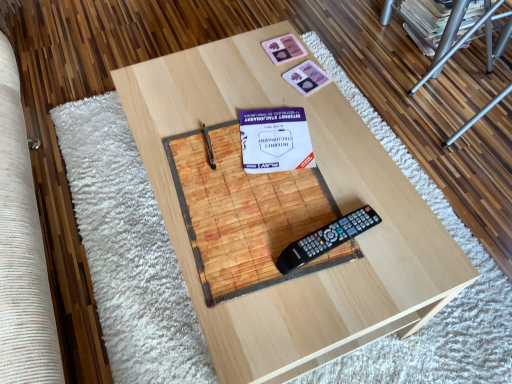
Question: Which direction should I rotate to look at pink matte playing card at upper center, which ranks as the 2th square in top-to-bottom order, — up or down?

Choices:
 (A) up
 (B) down

Answer: (A)

Question: Could you tell me if metallic silver ladder at upper right is turned towards white paper at center?

Choices:
 (A) yes
 (B) no

Answer: (B)

Question: Is metallic silver ladder at upper right positioned before white paper at center?

Choices:
 (A) yes
 (B) no

Answer: (B)

Question: Is metallic silver ladder at upper right with white paper at center?

Choices:
 (A) yes
 (B) no

Answer: (B)

Question: Does metallic silver ladder at upper right have a smaller size compared to white paper at center?

Choices:
 (A) no
 (B) yes

Answer: (A)

Question: From the image's perspective, is metallic silver ladder at upper right over white paper at center?

Choices:
 (A) yes
 (B) no

Answer: (A)

Question: Is metallic silver ladder at upper right oriented away from white paper at center?

Choices:
 (A) no
 (B) yes

Answer: (B)

Question: Is white paper at center wider than matte cardboard magazine at upper right?

Choices:
 (A) no
 (B) yes

Answer: (A)

Question: Is white paper at center oriented away from matte cardboard magazine at upper right?

Choices:
 (A) yes
 (B) no

Answer: (B)

Question: From the image's perspective, is white paper at center below matte cardboard magazine at upper right?

Choices:
 (A) no
 (B) yes

Answer: (B)

Question: Does white paper at center have a lesser width compared to matte cardboard magazine at upper right?

Choices:
 (A) yes
 (B) no

Answer: (A)

Question: Is white paper at center at the left side of matte cardboard magazine at upper right?

Choices:
 (A) yes
 (B) no

Answer: (A)

Question: From a real-world perspective, is white paper at center positioned over matte cardboard magazine at upper right based on gravity?

Choices:
 (A) no
 (B) yes

Answer: (B)

Question: Is black plastic remote control at center with wooden table at center?

Choices:
 (A) no
 (B) yes

Answer: (A)